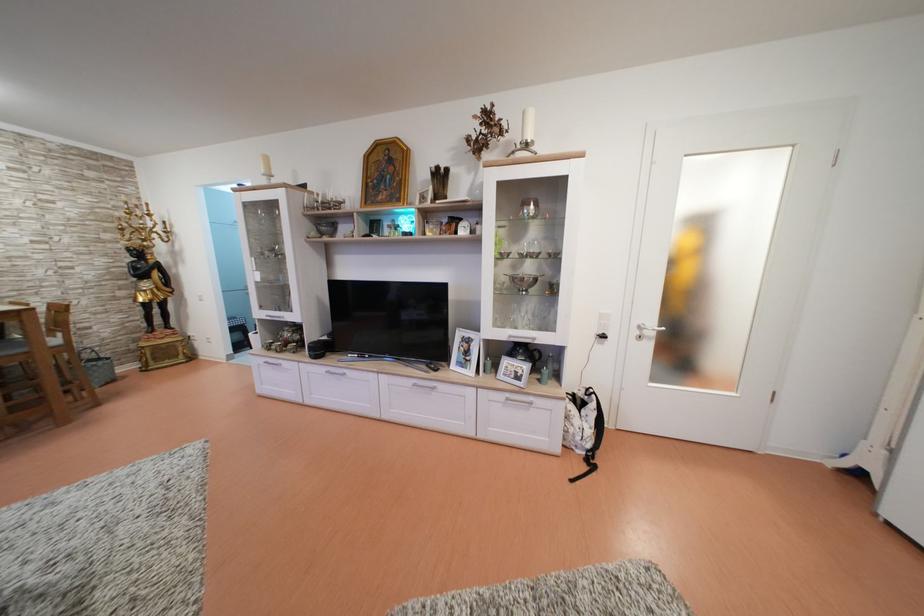
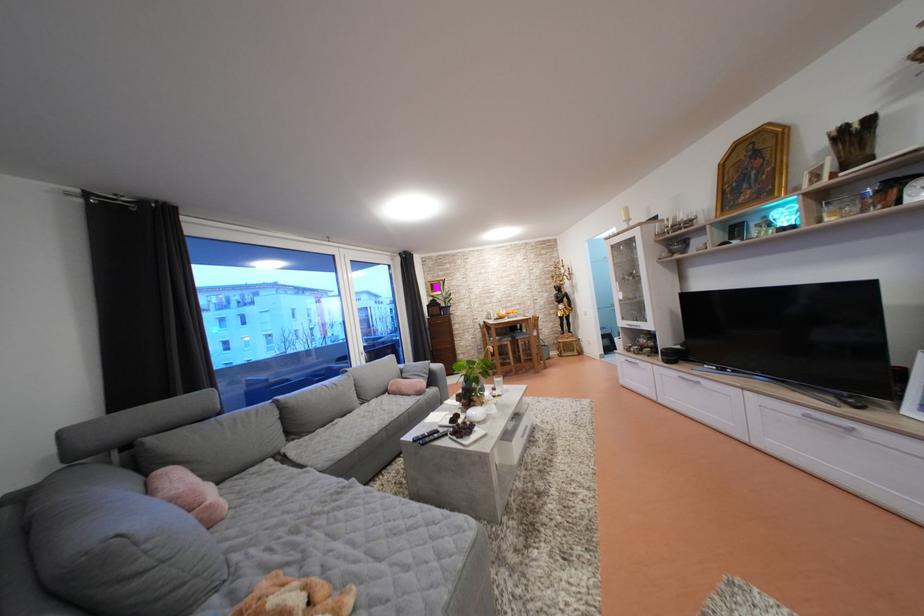
In the second image, find the point that corresponds to point (269, 365) in the first image.

(630, 363)